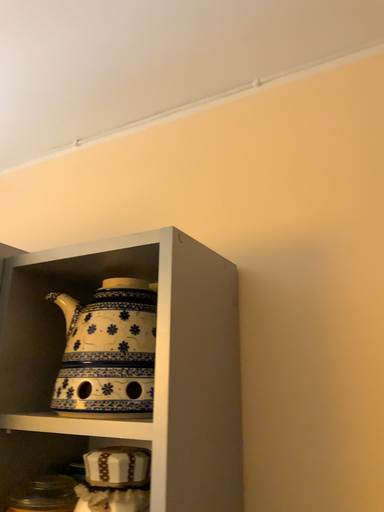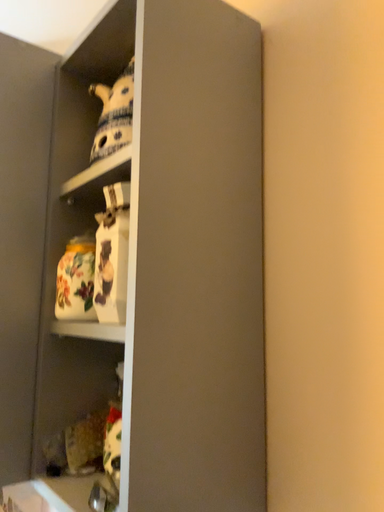
Question: How did the camera likely rotate when shooting the video?

Choices:
 (A) rotated right
 (B) rotated left

Answer: (B)